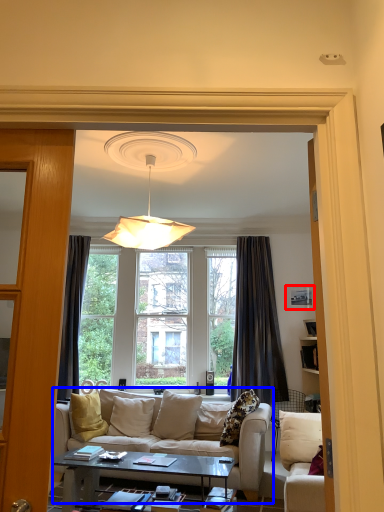
Question: Which object appears farthest to the camera in this image, picture frame (highlighted by a red box) or studio couch (highlighted by a blue box)?

Choices:
 (A) picture frame
 (B) studio couch

Answer: (A)